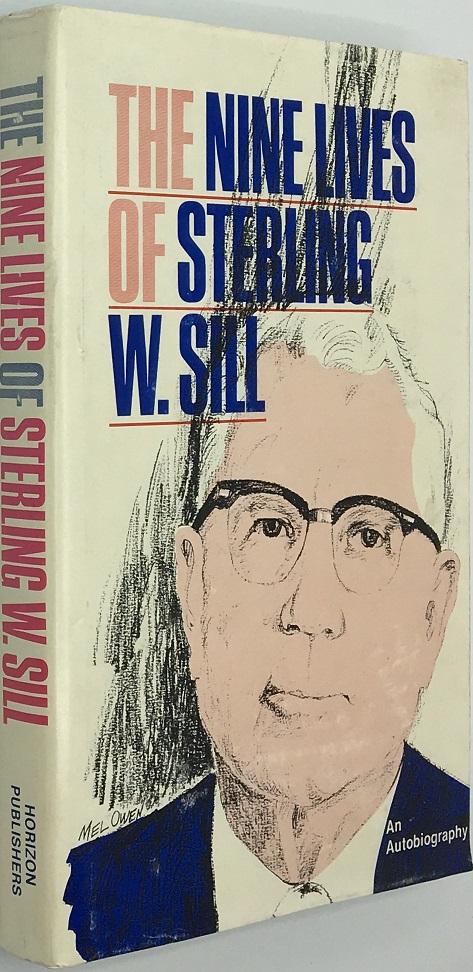
At what (x,y) coordinates should I click in order to perform the action: click on title on side of book. Please return your answer as a coordinate pair (x, y). This screenshot has height=972, width=473. Looking at the image, I should click on (25, 87).